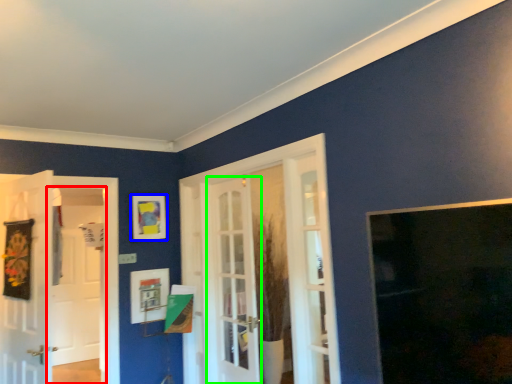
Question: Estimate the real-world distances between objects in this image. Which object is closer to screen door (highlighted by a red box), picture frame (highlighted by a blue box) or door (highlighted by a green box)?

Choices:
 (A) picture frame
 (B) door

Answer: (A)